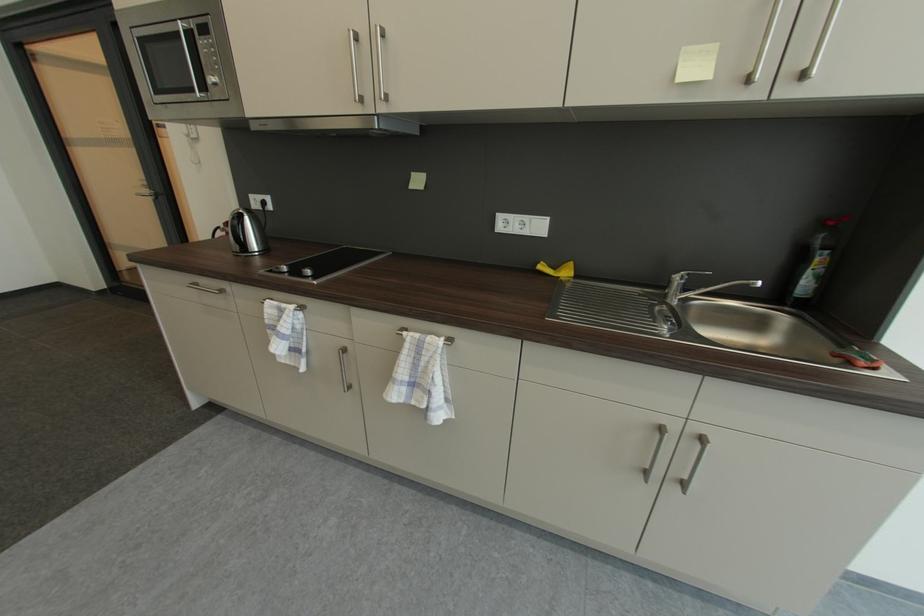
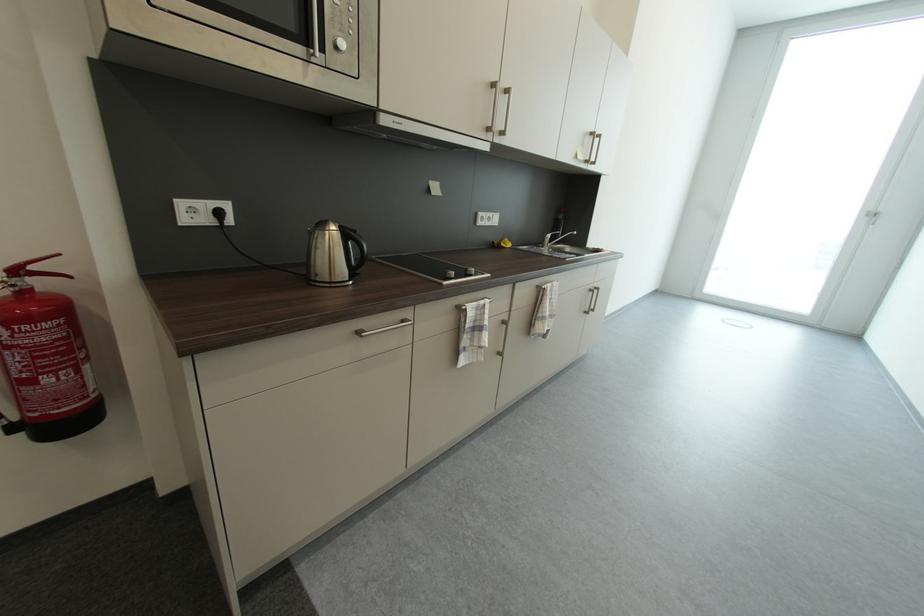
Find the pixel in the second image that matches point (543, 265) in the first image.

(501, 244)